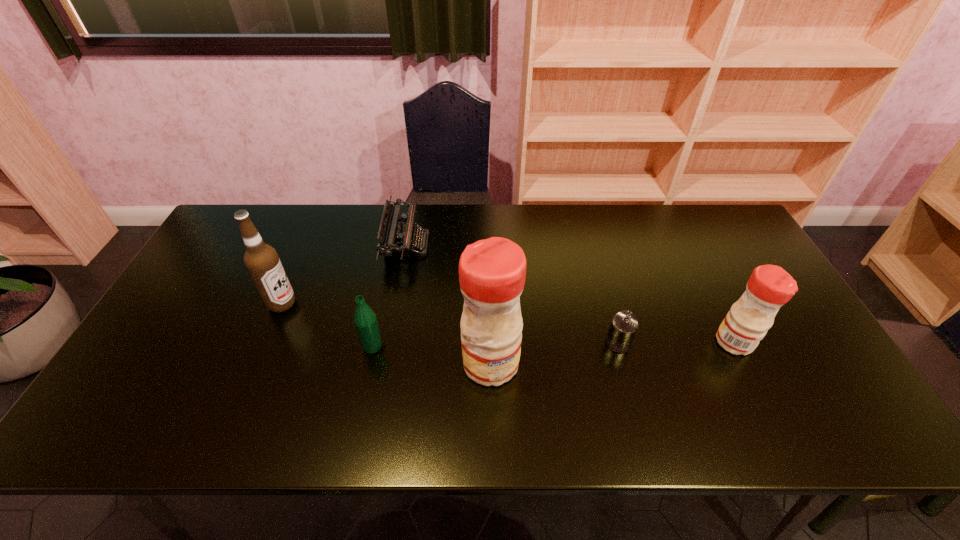
You are a GUI agent. You are given a task and a screenshot of the screen. Output one action in this format:
    pyautogui.click(x=<x>, y=<y>)
    Task: Click on the fourth object from left to right
    The image size is (960, 540).
    Given the screenshot: What is the action you would take?
    pyautogui.click(x=492, y=272)

Where is `the tallest object`? This screenshot has width=960, height=540. the tallest object is located at coordinates (492, 272).

In order to click on the fourth shortest object in this screenshot , I will do `click(769, 287)`.

Locate an element on the screen. the right condiment is located at coordinates (769, 287).

Where is `the farthest object`? The image size is (960, 540). the farthest object is located at coordinates (395, 239).

Identify the location of can. The width and height of the screenshot is (960, 540). (624, 324).

Where is `the fourth tallest object`? the fourth tallest object is located at coordinates (365, 320).

Image resolution: width=960 pixels, height=540 pixels. In order to click on the second tallest object in this screenshot , I will do `click(262, 261)`.

Locate an element on the screen. This screenshot has width=960, height=540. the fifth nearest object is located at coordinates (262, 261).

The width and height of the screenshot is (960, 540). Identify the location of free region located on the left of the tallest object. (371, 363).